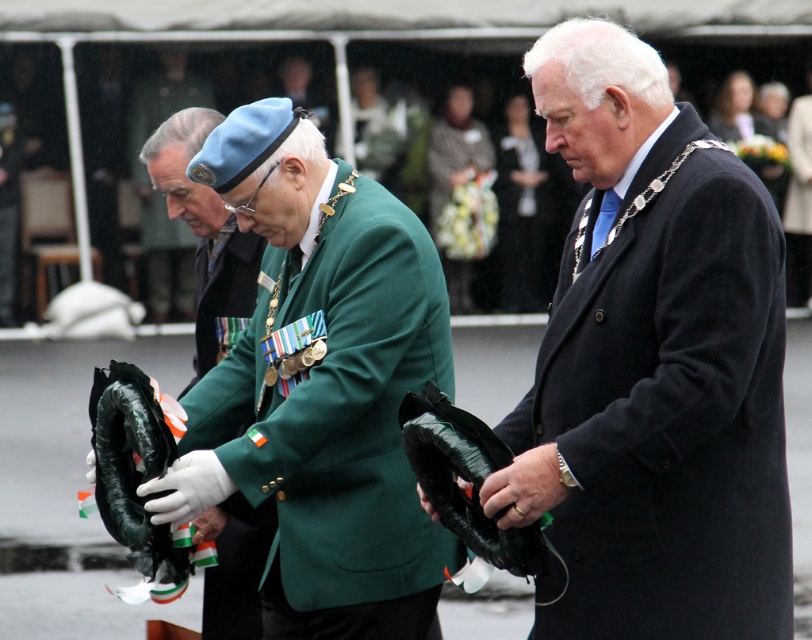
You are an observer at the commemorative ceremony. You notice the matte black coat at center and the green fabric beret at center. Which one is positioned lower in the image?

The matte black coat at center is below the green fabric beret at center, so the matte black coat at center is positioned lower in the image.

You are an event organizer planning to place a small flag between the green matte jacket at center and the green fabric beret at center. Based on their sizes, which object should the flag be closer to?

The green matte jacket at center occupies less space than the green fabric beret at center. Therefore, the flag should be placed closer to the green fabric beret at center since it is larger and will balance the arrangement better.